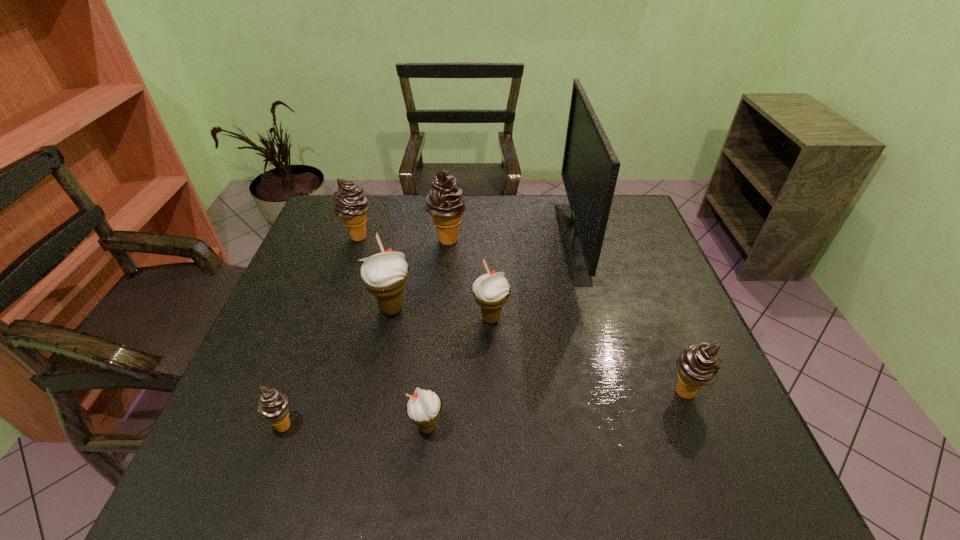
At what (x,y) coordinates should I click in order to perform the action: click on vacant position located 0.320m on the back of the third nearest object. Please return your answer as a coordinate pair (x, y). The height and width of the screenshot is (540, 960). Looking at the image, I should click on (640, 281).

This screenshot has width=960, height=540. I want to click on vacant space positioned on the front of the second biggest white icecream, so click(x=493, y=426).

Where is `vacant area situated on the right of the smallest white icecream`? The image size is (960, 540). vacant area situated on the right of the smallest white icecream is located at coordinates (567, 427).

I want to click on vacant space located on the back of the smallest chocolate icecream, so click(324, 314).

You are a GUI agent. You are given a task and a screenshot of the screen. Output one action in this format:
    pyautogui.click(x=<x>, y=<y>)
    Task: Click on the monitor that is at the far edge
    
    Given the screenshot: What is the action you would take?
    pyautogui.click(x=590, y=168)

Where is `object that is positioned at the right edge`? Image resolution: width=960 pixels, height=540 pixels. object that is positioned at the right edge is located at coordinates (698, 365).

The width and height of the screenshot is (960, 540). Find the location of `object situated at the far left corner`. object situated at the far left corner is located at coordinates (350, 203).

In the image, there is a desktop. Identify the location of vacant space at the far edge. (402, 201).

Where is `free space at the near edge`? The height and width of the screenshot is (540, 960). free space at the near edge is located at coordinates 496,494.

You are a GUI agent. You are given a task and a screenshot of the screen. Output one action in this format:
    pyautogui.click(x=<x>, y=<y>)
    Task: Click on the free space at the left edge
    Image resolution: width=960 pixels, height=540 pixels.
    Given the screenshot: What is the action you would take?
    pyautogui.click(x=336, y=315)